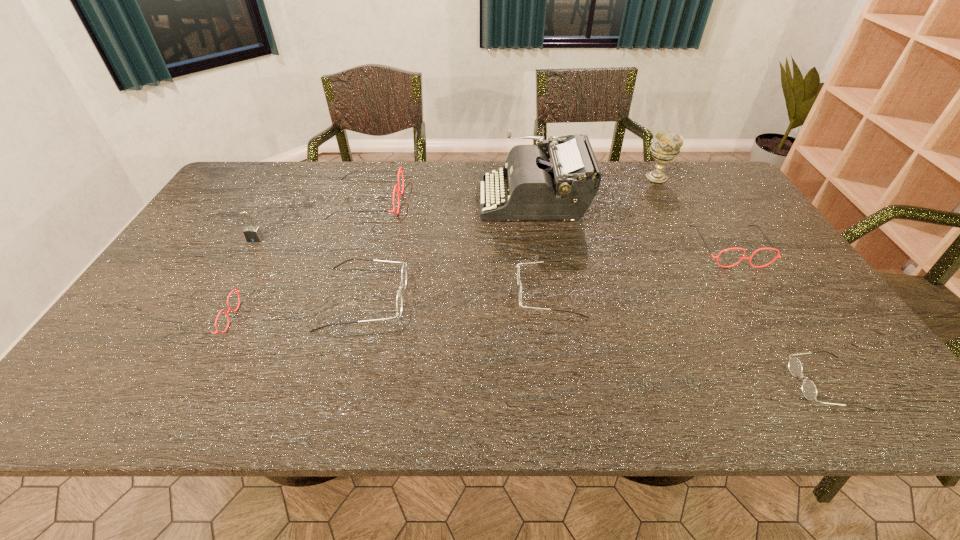
The width and height of the screenshot is (960, 540). Find the location of `the tallest object`. the tallest object is located at coordinates (561, 185).

Image resolution: width=960 pixels, height=540 pixels. Identify the location of the second tallest object. (665, 146).

The width and height of the screenshot is (960, 540). Find the location of `chalice`. chalice is located at coordinates (665, 146).

Locate an element on the screen. The width and height of the screenshot is (960, 540). padlock is located at coordinates (253, 234).

Identify the location of the farthest red spectacles. This screenshot has height=540, width=960. (398, 191).

Where is `the farthest spectacles`? the farthest spectacles is located at coordinates [x=398, y=191].

The width and height of the screenshot is (960, 540). Find the location of `the second nearest red spectacles`. the second nearest red spectacles is located at coordinates (777, 251).

Where is `the rightmost red spectacles`? This screenshot has width=960, height=540. the rightmost red spectacles is located at coordinates (777, 251).

What are the coordinates of `the leftmost dark spectacles` in the screenshot? It's located at (404, 272).

Find the location of `the second dark spectacles from right to left`. the second dark spectacles from right to left is located at coordinates (518, 270).